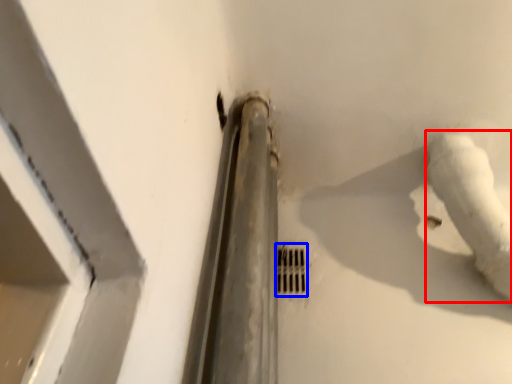
Question: Among these objects, which one is farthest to the camera, water pipe (highlighted by a red box) or hole (highlighted by a blue box)?

Choices:
 (A) water pipe
 (B) hole

Answer: (B)